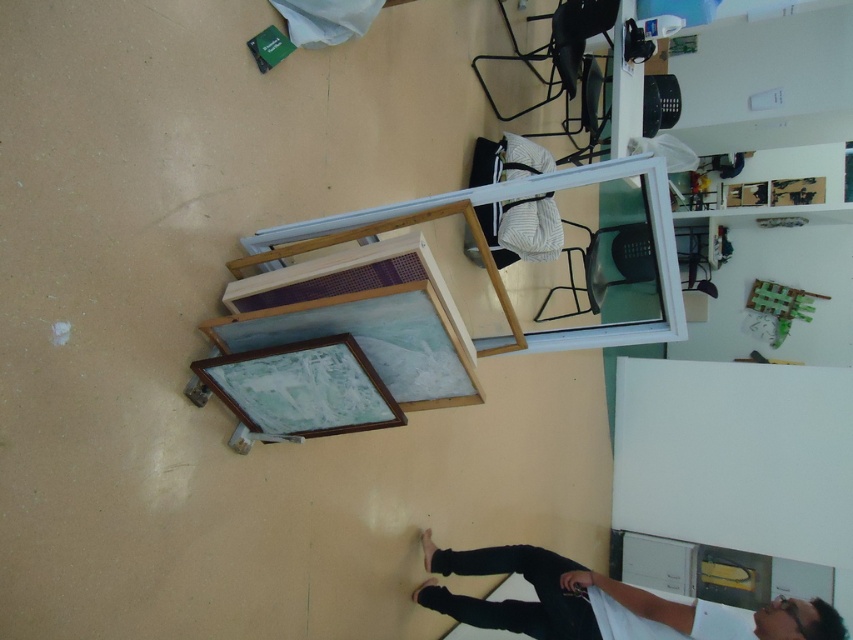
In the scene shown: You are an art curator entering the studio and see the white matte shirt at lower right and the wooden picture frame at lower center. Which object is taller?

The white matte shirt at lower right is much taller than the wooden picture frame at lower center.

You are standing in the art studio and want to take a photo of the framed artworks leaning against the wall. Your camera is at your eye level, which is 5 feet high. The white matte shirt at lower right is in the foreground. Will the shirt block the view of the framed artworks when taking the photo?

The white matte shirt at lower right is 7.01 feet away from the camera, which is farther than the camera height of 5 feet. Since the shirt is in the foreground but positioned at a distance greater than the camera height, it may not necessarily block the view of the framed artworks. However, without knowing the exact position and size of the shirt relative to the artworks, it is difficult to determine definitively.

You are an artist trying to organize your studio. You see the white matte shirt at lower right and the wooden frame at lower center. Which object is closer to the floor?

The white matte shirt at lower right is positioned under the wooden frame at lower center, so the white matte shirt at lower right is closer to the floor.